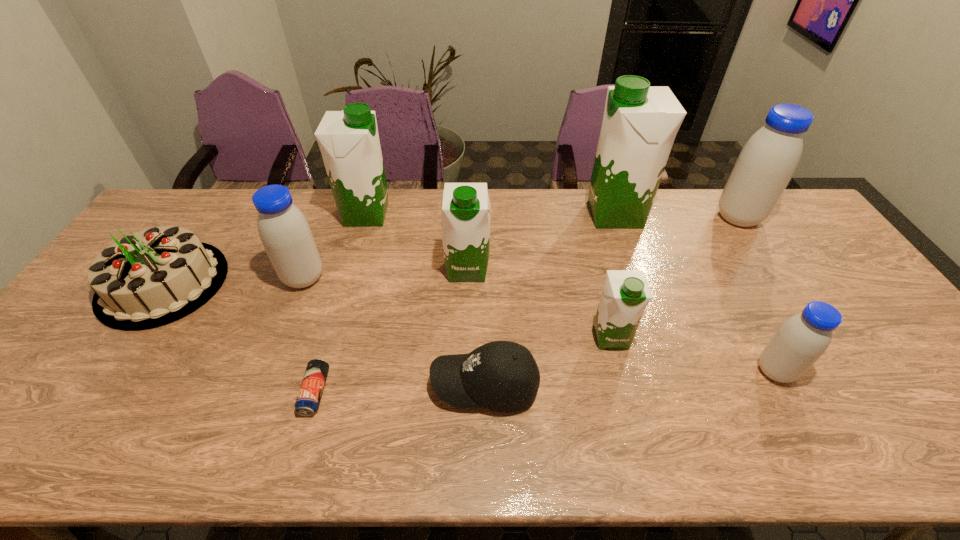
Locate an element on the screen. The image size is (960, 540). free region at the near left corner is located at coordinates (38, 447).

Find the location of `vacant space at the far right corner`. vacant space at the far right corner is located at coordinates (788, 197).

I want to click on free space at the near right corner of the desktop, so click(x=956, y=440).

Where is `free space between the second biggest green soya milk and the nearest blue soya milk`? The image size is (960, 540). free space between the second biggest green soya milk and the nearest blue soya milk is located at coordinates (570, 293).

The image size is (960, 540). I want to click on blank region between the black baseball cap and the tallest object, so click(550, 300).

Where is `free point between the blue beer can and the tallest soya milk`? free point between the blue beer can and the tallest soya milk is located at coordinates (466, 303).

At what (x,y) coordinates should I click in order to perform the action: click on empty location between the ninth tallest object and the third farthest green soya milk. Please return your answer as a coordinate pair (x, y). The width and height of the screenshot is (960, 540). Looking at the image, I should click on (476, 327).

Identify the location of empty space that is in between the leftmost object and the baseball cap. (324, 334).

Where is `free space that is in between the second shortest object and the second nearest blue soya milk`? This screenshot has width=960, height=540. free space that is in between the second shortest object and the second nearest blue soya milk is located at coordinates (395, 332).

The height and width of the screenshot is (540, 960). Find the location of `free space between the blue beer can and the second biggest blue soya milk`. free space between the blue beer can and the second biggest blue soya milk is located at coordinates (309, 335).